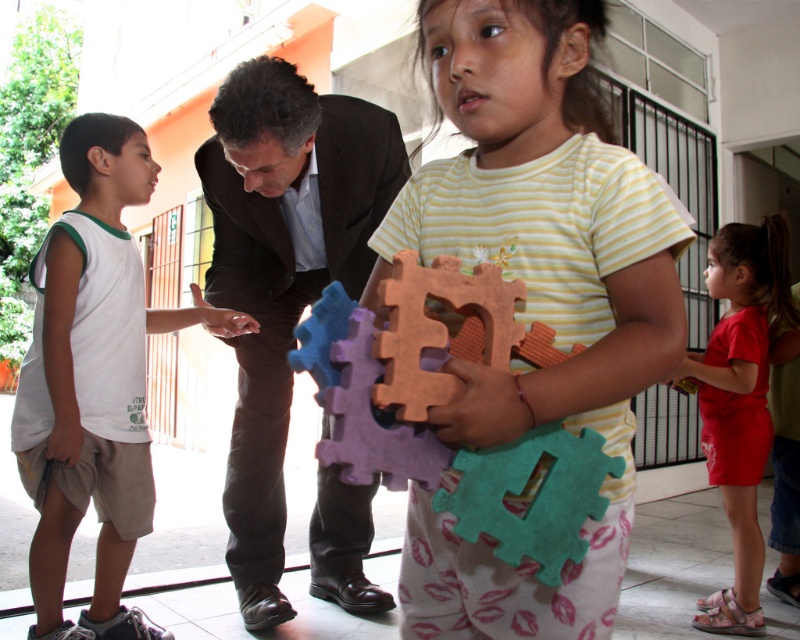
You are standing in the community center and see the dark brown suit at center and the matte red shorts at lower right. Which object is nearer to you?

The dark brown suit at center is closer to the viewer than the matte red shorts at lower right.